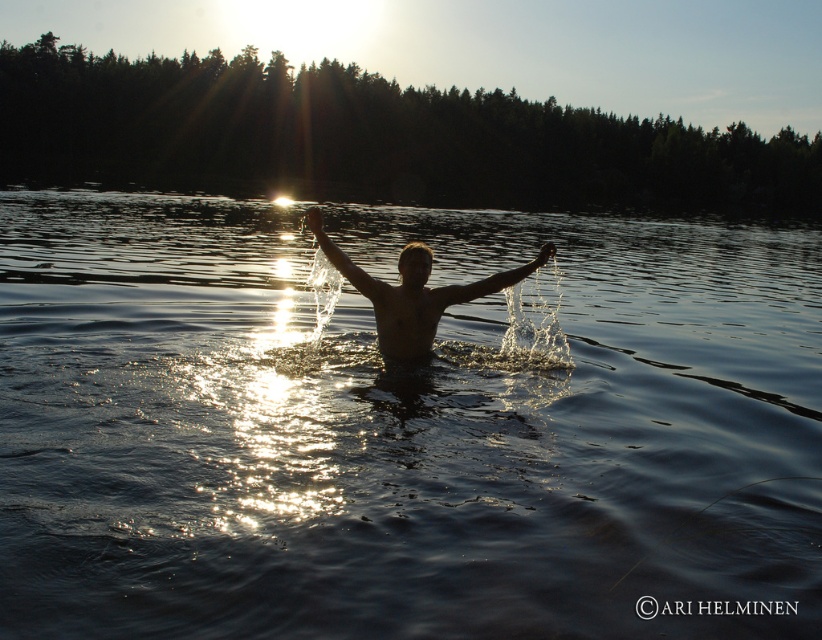
Between dark liquid water at center and silhouette skin person at center, which one has more height?

Standing taller between the two is dark liquid water at center.

Is dark liquid water at center shorter than silhouette skin person at center?

No, dark liquid water at center is not shorter than silhouette skin person at center.

Locate an element on the screen. The image size is (822, 640). dark liquid water at center is located at coordinates (399, 428).